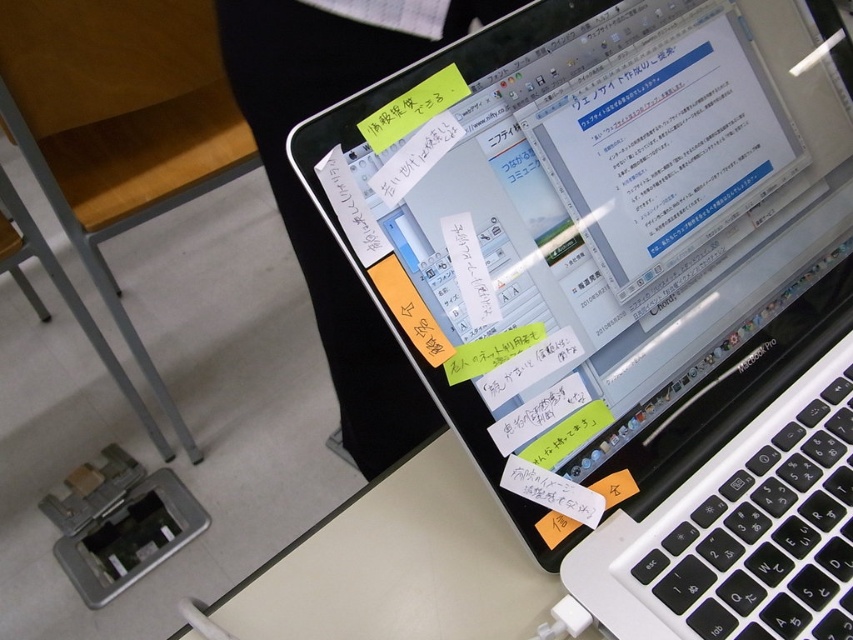
You are a student who needs to plug in a USB drive into the white plastic laptop at center. The USB drive is currently on the desk 45.03 centimeters away from the laptop. Is the USB drive within a comfortable reaching distance for you to plug it in without moving your chair?

Result: The USB drive is 45.03 centimeters away from the white plastic laptop at center. The comfortable reaching distance for most people is typically around 30 to 45 centimeters. Therefore, the USB drive is within a comfortable reaching distance for you to plug it in without moving your chair.

You are a student trying to clean the desk. You need to remove the yellow sticky note at upper center first. Can you take it off without moving the white plastic laptop at center?

The white plastic laptop at center is in front of the yellow sticky note at upper center, so you can take off the yellow sticky note at upper center without moving the laptop because it is accessible from above.

You need to place a yellow sticky note at center on top of the white plastic laptop at center. Based on their sizes, will the sticky note cover the entire screen?

The white plastic laptop at center is larger than the yellow sticky note at center, so the sticky note will not cover the entire screen.